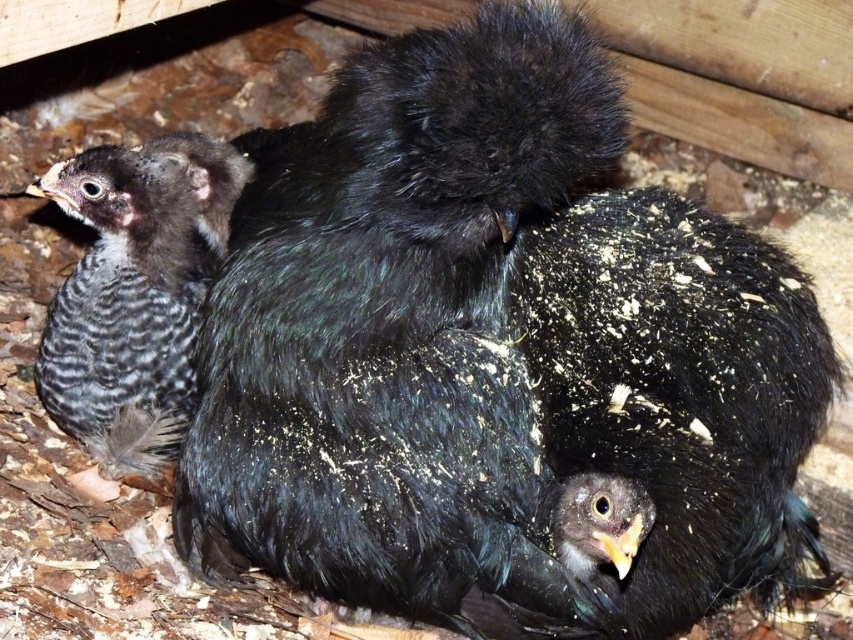
Question: Can you confirm if black fluffy bird at center is thinner than speckled feathered chick at left?

Choices:
 (A) no
 (B) yes

Answer: (A)

Question: Observing the image, what is the correct spatial positioning of black fluffy bird at center in reference to speckled feathered chick at left?

Choices:
 (A) above
 (B) below

Answer: (B)

Question: Is black fluffy bird at center below speckled feathered chick at left?

Choices:
 (A) yes
 (B) no

Answer: (A)